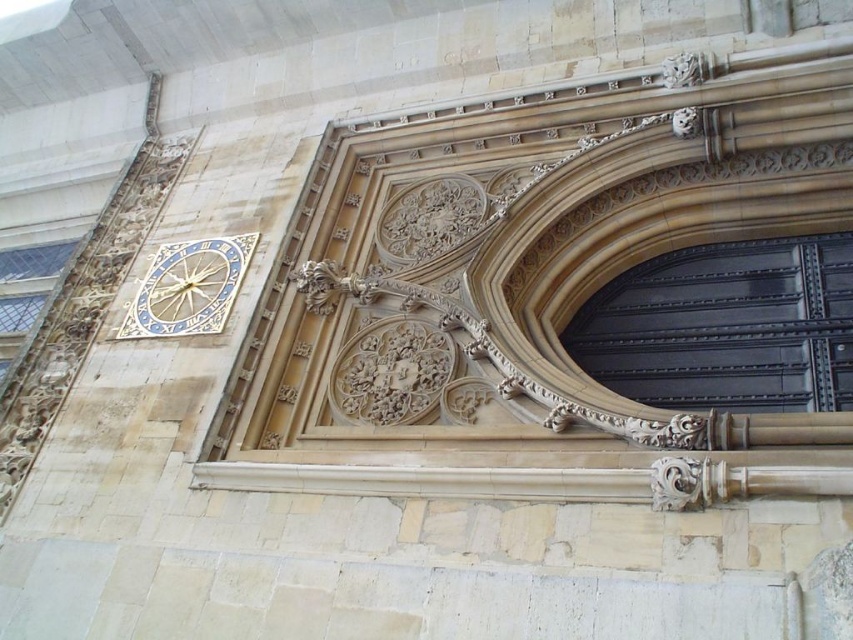
Is point (757, 202) farther from camera compared to point (695, 388)?

Yes, point (757, 202) is behind point (695, 388).

The height and width of the screenshot is (640, 853). In order to click on brown stone archway at center in this screenshot , I will do `click(531, 291)`.

The width and height of the screenshot is (853, 640). I want to click on brown stone archway at center, so click(x=531, y=291).

Is brown stone archway at center taller than gold metallic clock at upper left?

Indeed, brown stone archway at center has a greater height compared to gold metallic clock at upper left.

In order to click on brown stone archway at center in this screenshot , I will do `click(531, 291)`.

Identify the location of brown stone archway at center. (531, 291).

Where is `black metal gate at center`? black metal gate at center is located at coordinates (726, 326).

Which is in front, point (780, 278) or point (143, 320)?

Point (780, 278) is more forward.

Where is `black metal gate at center`? This screenshot has height=640, width=853. black metal gate at center is located at coordinates (726, 326).